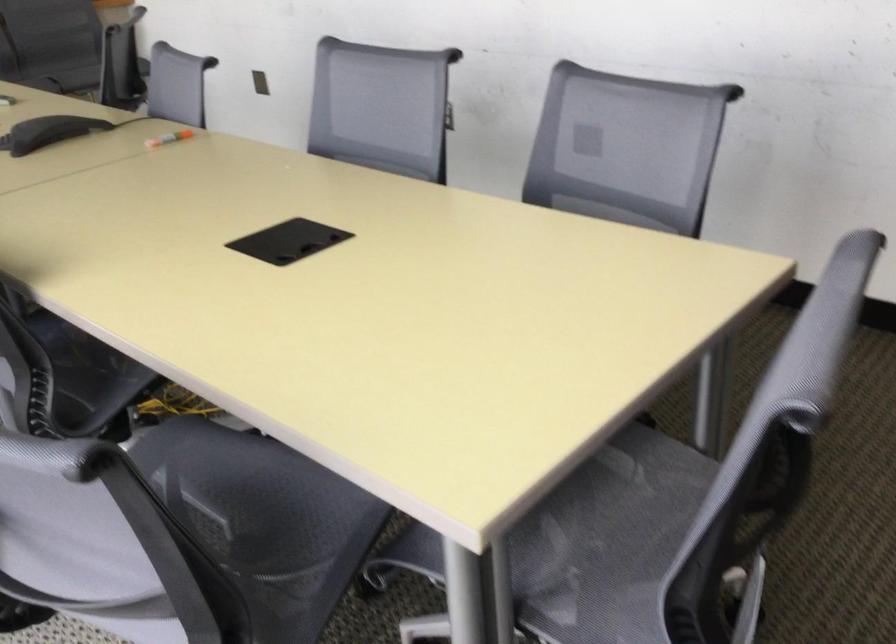
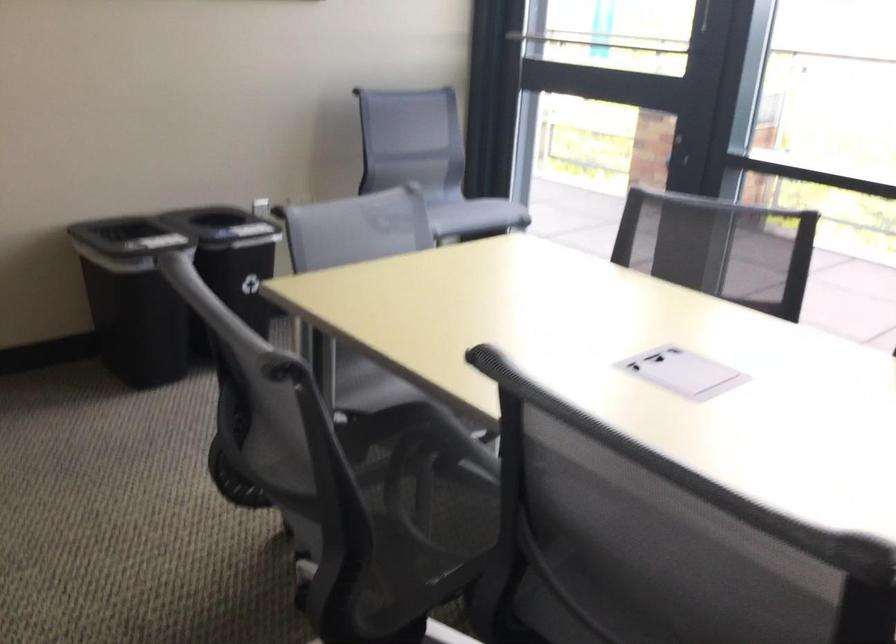
In the second image, find the point that corresponds to (729,562) in the first image.

(356, 361)